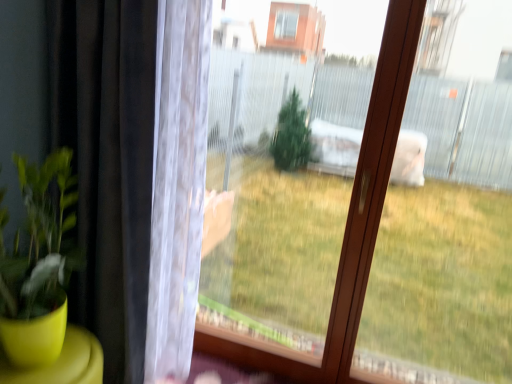
Question: Is black matte curtain at left facing towards transparent plastic screen at center?

Choices:
 (A) no
 (B) yes

Answer: (A)

Question: Is black matte curtain at left outside of transparent plastic screen at center?

Choices:
 (A) yes
 (B) no

Answer: (A)

Question: From the image's perspective, is black matte curtain at left beneath transparent plastic screen at center?

Choices:
 (A) yes
 (B) no

Answer: (B)

Question: Can transparent plastic screen at center be found inside black matte curtain at left?

Choices:
 (A) yes
 (B) no

Answer: (B)

Question: Is black matte curtain at left closer to the viewer compared to transparent plastic screen at center?

Choices:
 (A) yes
 (B) no

Answer: (A)

Question: Can you confirm if black matte curtain at left is wider than transparent plastic screen at center?

Choices:
 (A) yes
 (B) no

Answer: (A)

Question: From a real-world perspective, is transparent plastic screen at center physically above black matte curtain at left?

Choices:
 (A) no
 (B) yes

Answer: (B)

Question: Is transparent plastic screen at center not inside black matte curtain at left?

Choices:
 (A) no
 (B) yes

Answer: (B)

Question: Are transparent plastic screen at center and black matte curtain at left far apart?

Choices:
 (A) no
 (B) yes

Answer: (A)

Question: Does transparent plastic screen at center have a larger size compared to black matte curtain at left?

Choices:
 (A) no
 (B) yes

Answer: (A)

Question: Would you say transparent plastic screen at center contains black matte curtain at left?

Choices:
 (A) no
 (B) yes

Answer: (A)

Question: Can you confirm if transparent plastic screen at center is positioned to the left of black matte curtain at left?

Choices:
 (A) no
 (B) yes

Answer: (A)

Question: Looking at their shapes, would you say black matte curtain at left is wider or thinner than transparent plastic screen at center?

Choices:
 (A) wide
 (B) thin

Answer: (A)